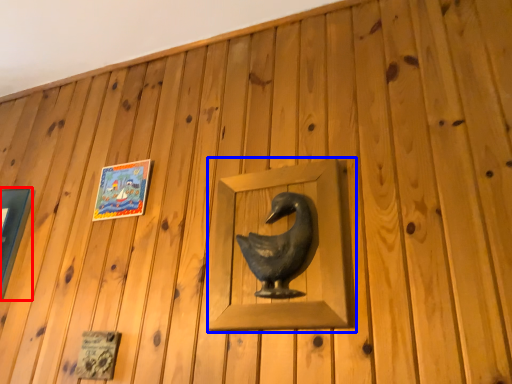
Question: Which point is closer to the camera, picture frame (highlighted by a red box) or sculpture (highlighted by a blue box)?

Choices:
 (A) picture frame
 (B) sculpture

Answer: (B)